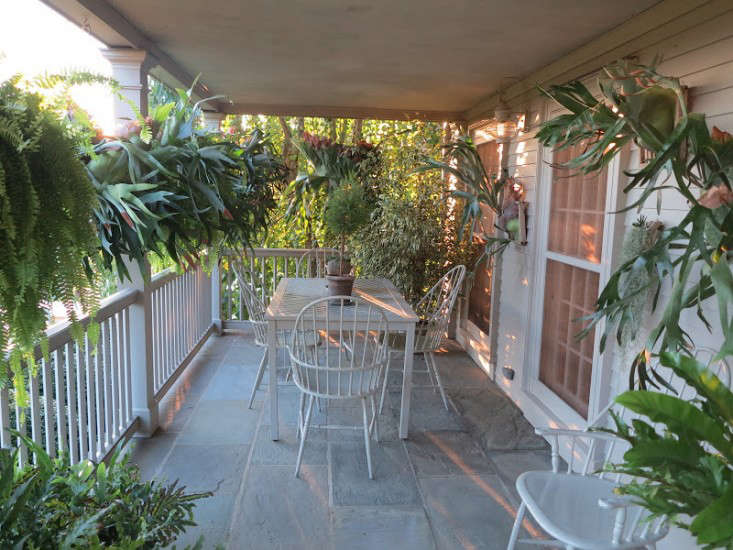
Where is `floor`? The width and height of the screenshot is (733, 550). floor is located at coordinates (248, 475).